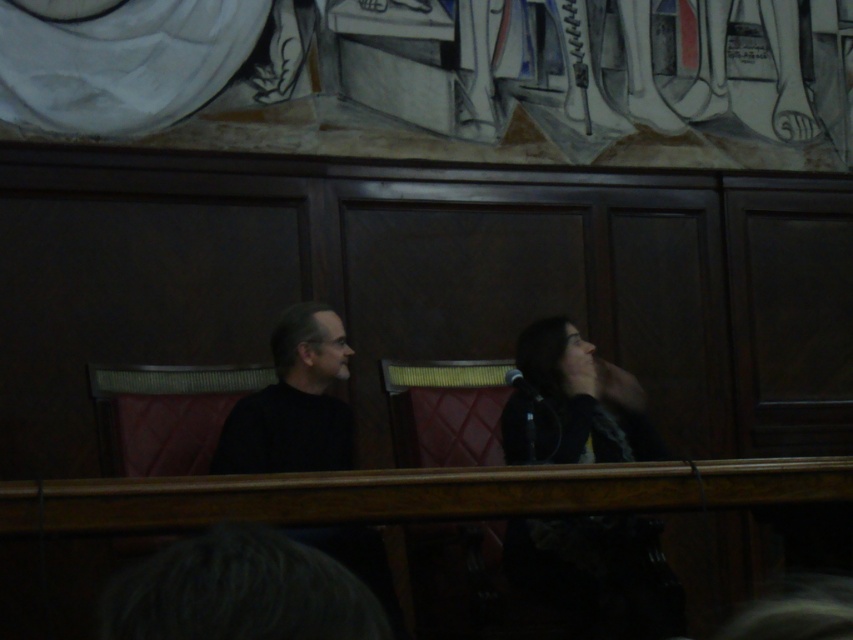
Which is below, black matte jacket at right or black matte shirt at left?

black matte jacket at right

Based on the photo, does black matte jacket at right have a lesser height compared to black matte shirt at left?

No, black matte jacket at right is not shorter than black matte shirt at left.

The width and height of the screenshot is (853, 640). I want to click on black matte jacket at right, so click(598, 572).